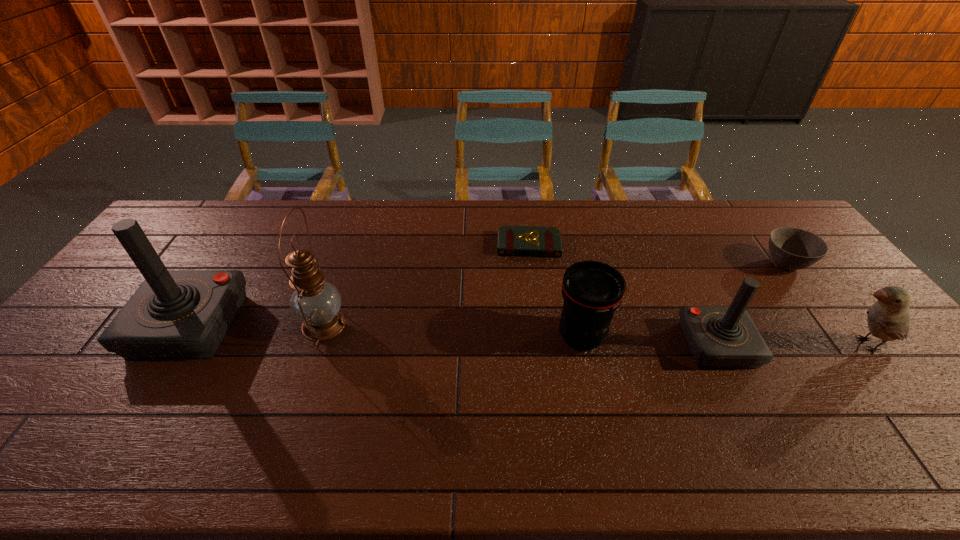
Where is `vacant position for inserting another joystick evenly`? This screenshot has height=540, width=960. vacant position for inserting another joystick evenly is located at coordinates (448, 335).